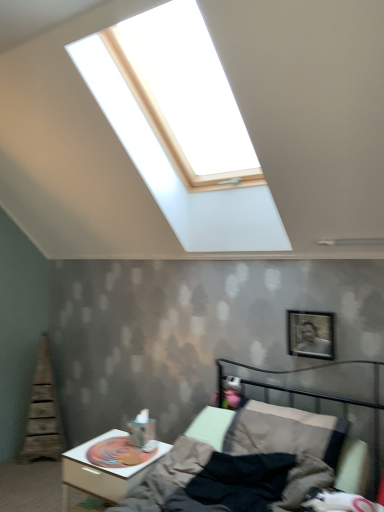
Question: Choose the correct answer: Is white glossy nightstand at lower left inside metallic silver picture frame at upper right or outside it?

Choices:
 (A) inside
 (B) outside

Answer: (B)

Question: From the image's perspective, is white glossy nightstand at lower left above or below metallic silver picture frame at upper right?

Choices:
 (A) below
 (B) above

Answer: (A)

Question: Which is nearer to the white glossy nightstand at lower left?

Choices:
 (A) metallic silver picture frame at upper right
 (B) metallic gray bed at lower right

Answer: (B)

Question: Based on their relative distances, which object is farther from the metallic gray bed at lower right?

Choices:
 (A) metallic silver picture frame at upper right
 (B) white glossy nightstand at lower left

Answer: (B)